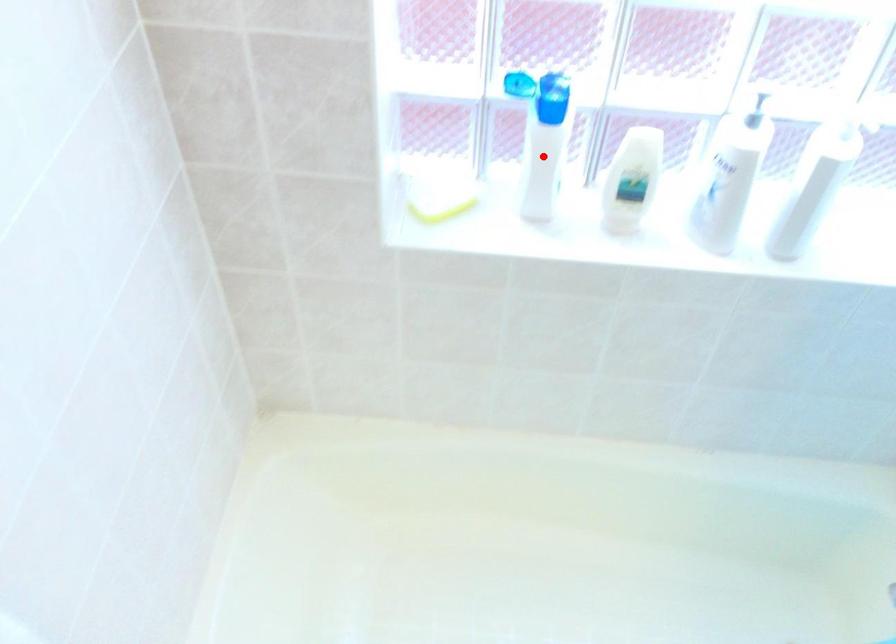
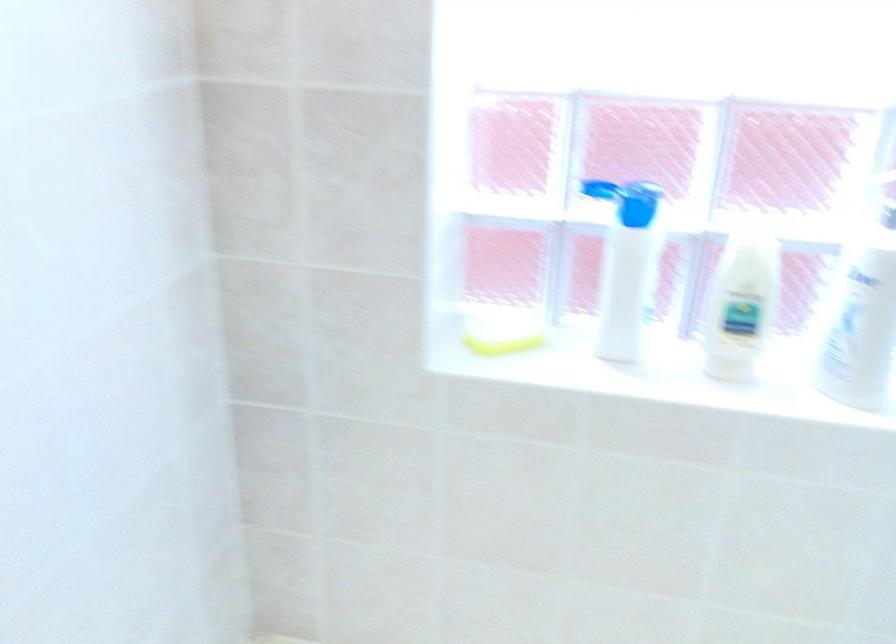
Question: A red point is marked in image1. In image2, is the corresponding 3D point closer to the camera or farther? Reply with the corresponding letter.

Choices:
 (A) The corresponding 3D point is closer.
 (B) The corresponding 3D point is farther.

Answer: (A)